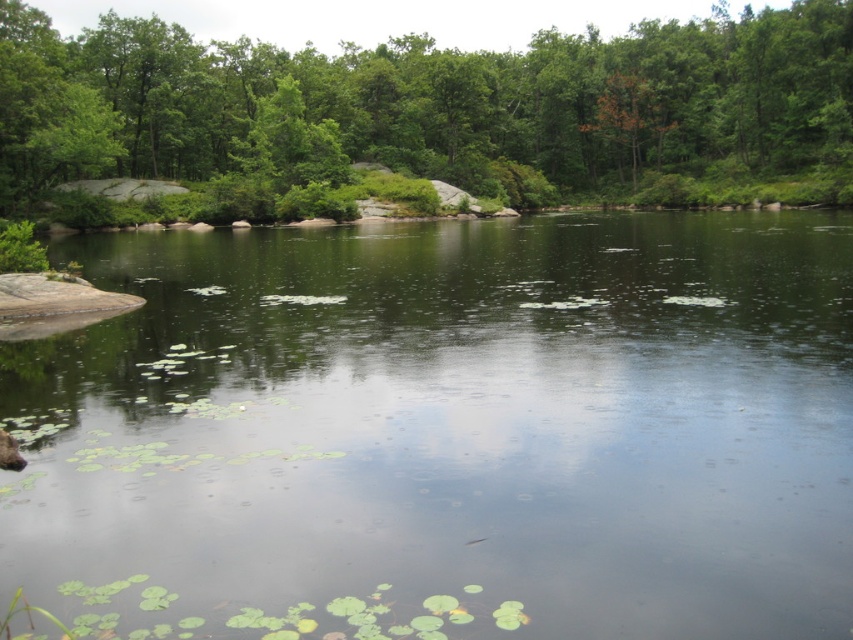
Can you confirm if green leafy tree at center is positioned above orange-brown wood tree at upper center?

Yes.

Between green leafy tree at center and orange-brown wood tree at upper center, which one has more height?

With more height is green leafy tree at center.

Describe the element at coordinates (438, 108) in the screenshot. I see `green leafy tree at center` at that location.

Where is `green leafy tree at center`? The width and height of the screenshot is (853, 640). green leafy tree at center is located at coordinates (438, 108).

Can you confirm if orange-brown wood tree at upper center is bigger than brown furry animal at lower left?

Yes, orange-brown wood tree at upper center is bigger than brown furry animal at lower left.

Who is higher up, orange-brown wood tree at upper center or brown furry animal at lower left?

orange-brown wood tree at upper center

Is point (660, 116) farther from viewer compared to point (16, 458)?

Yes, point (660, 116) is behind point (16, 458).

Where is `orange-brown wood tree at upper center`? The image size is (853, 640). orange-brown wood tree at upper center is located at coordinates (631, 116).

Between green smooth water at center and orange-brown wood tree at upper center, which one has less height?

Standing shorter between the two is green smooth water at center.

Between green smooth water at center and orange-brown wood tree at upper center, which one is positioned lower?

Positioned lower is green smooth water at center.

Between point (677, 401) and point (631, 161), which one is positioned in front?

Point (677, 401) is in front.

You are a GUI agent. You are given a task and a screenshot of the screen. Output one action in this format:
    pyautogui.click(x=<x>, y=<y>)
    Task: Click on the green smooth water at center
    The width and height of the screenshot is (853, 640).
    Given the screenshot: What is the action you would take?
    pyautogui.click(x=445, y=433)